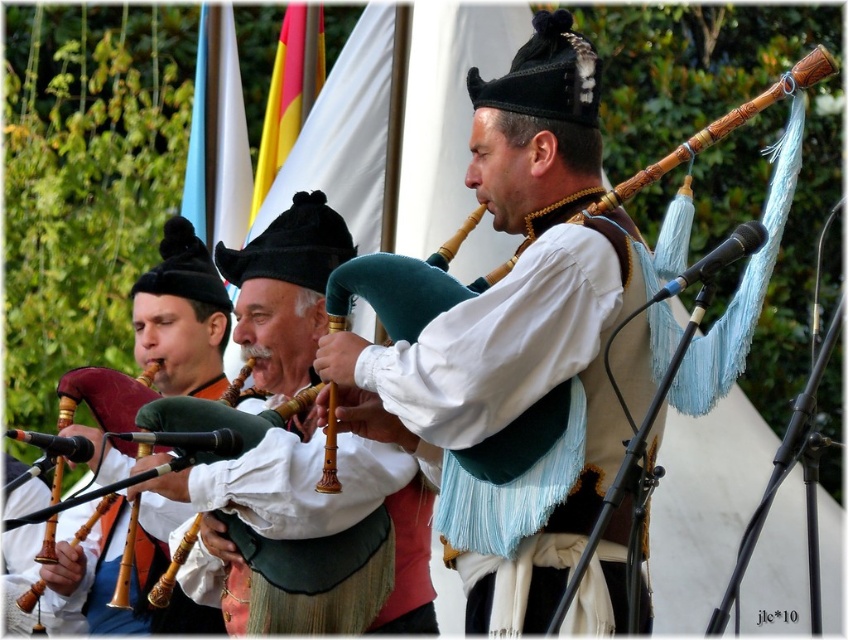
You are a photographer standing in front of the performers. You want to capture a photo of the matte black bagpipe at left and the wooden pipes at left in the same frame. The camera you are using has a maximum focus range of 2 meters. Can you get both objects in focus without moving your position?

The matte black bagpipe at left and wooden pipes at left are 2.23 meters apart from each other. Since the distance between them exceeds the camera maximum focus range of 2 meters, you cannot get both objects in focus without moving your position.

You are a photographer trying to capture the bagpiper in the scene. You notice two points marked in the image. The first point is at coordinates point (713,378) and the second point is at point (93,515). Which point is closer to the camera and thus would be better for focusing on the bagpiper?

Point (713,378) is closer to the camera than point (93,515), so focusing on point (713,378) would be better for capturing the bagpiper clearly.

From the picture: You are standing at the front of the performance area and want to hand a flower to the performer playing the wooden bagpipes at center. Considering the distance between you and the bagpipes, is it possible for you to reach them without moving closer?

The wooden bagpipes at center are 55.06 meters away from the viewer, which is too far to reach without moving closer. You would need to approach them to hand the flower.